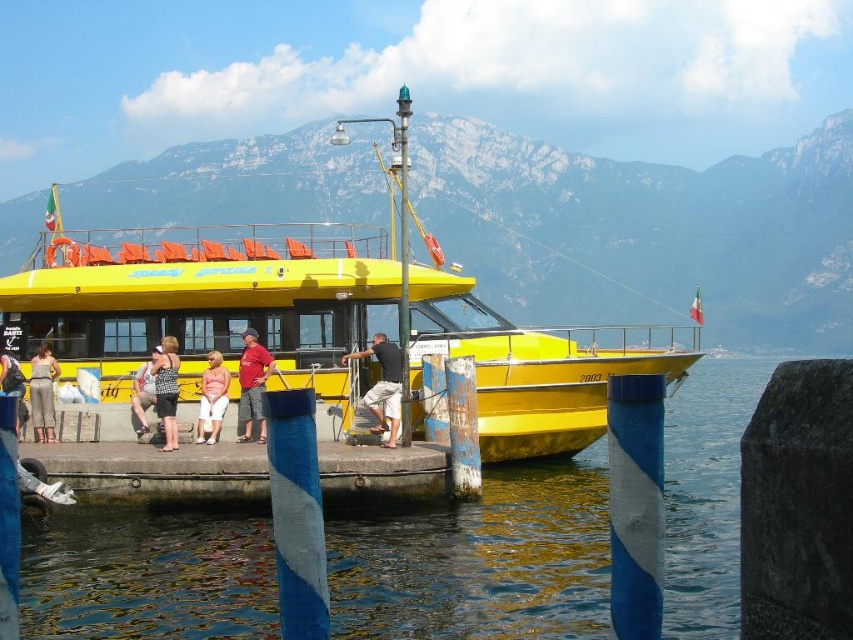
Looking at this image, you are a photographer standing on the pier and want to take a photo of the black cotton shirt at center and denim pants at left. Which object is positioned closer to your camera lens?

The black cotton shirt at center is closer to the viewer than denim pants at left, so it will appear closer to your camera lens.

You are standing on the pier and want to take a photo of the clear blue water at lower center. Where should you position yourself to capture it in the frame?

The clear blue water at lower center is located at point coordinates approximately 0.877 on the x axis and 0.563 on the y axis. To capture it in your photo, position yourself at that coordinate point.